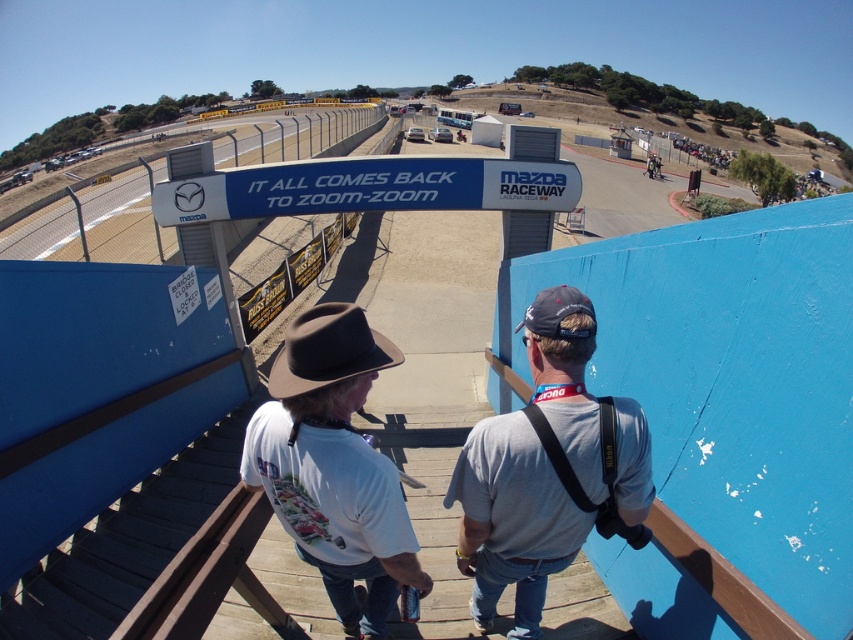
Is gray fabric shirt at center above blue plastic sign at center?

Actually, gray fabric shirt at center is below blue plastic sign at center.

Based on the photo, which of these two, gray fabric shirt at center or blue plastic sign at center, stands taller?

gray fabric shirt at center

Between point (531, 352) and point (397, 195), which one is positioned in front?

Point (531, 352) is more forward.

The width and height of the screenshot is (853, 640). In order to click on gray fabric shirt at center in this screenshot , I will do `click(547, 468)`.

Does gray fabric shirt at center appear on the right side of white cotton t-shirt at center?

Correct, you'll find gray fabric shirt at center to the right of white cotton t-shirt at center.

Which is more to the left, gray fabric shirt at center or white cotton t-shirt at center?

white cotton t-shirt at center is more to the left.

Which is behind, point (610, 410) or point (320, 536)?

The point (320, 536) is behind.

The image size is (853, 640). In order to click on gray fabric shirt at center in this screenshot , I will do `click(547, 468)`.

Between white cotton t-shirt at center and blue plastic sign at center, which one appears on the right side from the viewer's perspective?

From the viewer's perspective, white cotton t-shirt at center appears more on the right side.

What do you see at coordinates (334, 467) in the screenshot?
I see `white cotton t-shirt at center` at bounding box center [334, 467].

Is point (343, 563) positioned behind point (260, 195)?

No.

You are a GUI agent. You are given a task and a screenshot of the screen. Output one action in this format:
    pyautogui.click(x=<x>, y=<y>)
    Task: Click on the white cotton t-shirt at center
    The width and height of the screenshot is (853, 640).
    Given the screenshot: What is the action you would take?
    pyautogui.click(x=334, y=467)